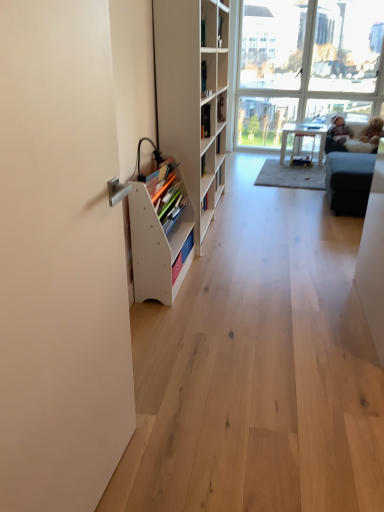
The image size is (384, 512). I want to click on vacant area that is situated to the right of white wood bookshelf at left, which is the 2th shelf in top-to-bottom order, so click(x=230, y=280).